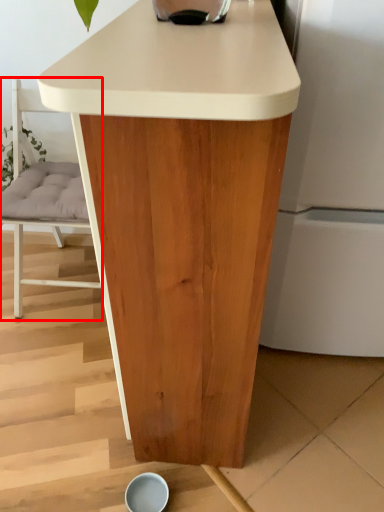
Question: From the image, what is the correct spatial relationship of chair (annotated by the red box) in relation to table?

Choices:
 (A) right
 (B) left

Answer: (B)